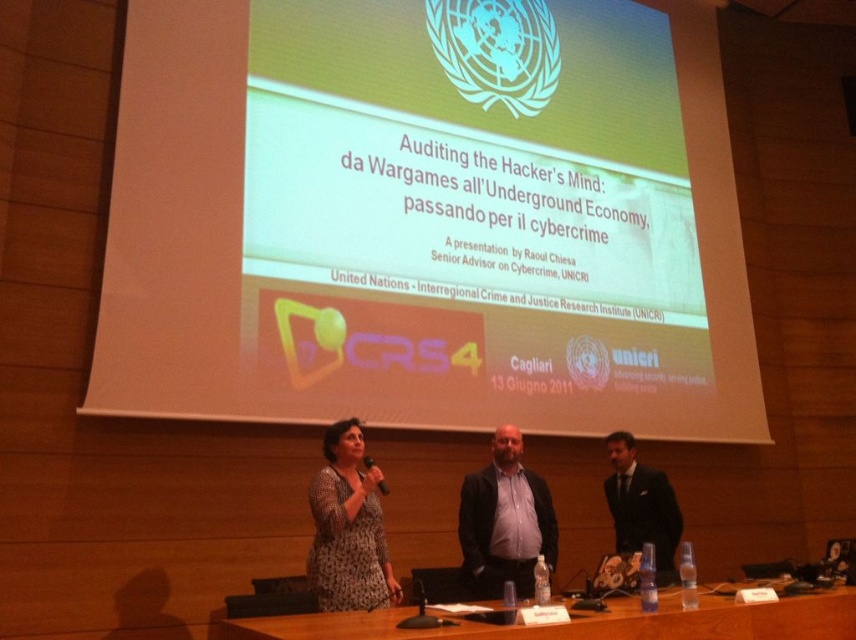
You are an event organizer who needs to rearrange the wooden table at center and the printed fabric dress at center for a photoshoot. According to the current setup, which object is located to the right of the other?

The wooden table at center is positioned on the right side of the printed fabric dress at center, so the wooden table at center is to the right of the printed fabric dress at center.

You are organizing a small reception after the presentation and need to place a 1.2 meter wide banner on the wooden table at center. Considering the printed fabric dress at center is already on the table, will there be enough space for the banner?

The wooden table at center might be wider than the printed fabric dress at center, so there might be enough space for the banner if the table is indeed wider. However, since the exact dimensions aren not provided, it is uncertain.

You are an attendee at this presentation and you want to approach the speaker who is wearing a dark suit at center. There is a printed fabric dress at center blocking your path. Which direction should you move to go around them?

The printed fabric dress at center is to the left of dark suit at center, so you should move to the right to go around them.